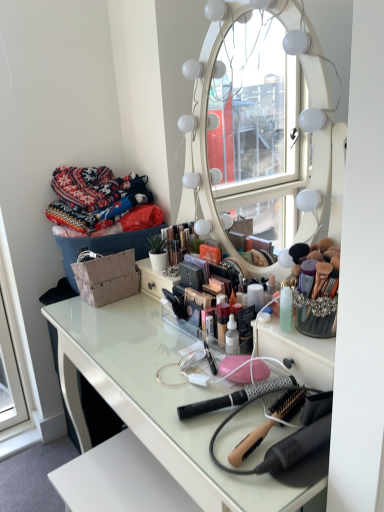
In order to face knitted fabric sweater at upper left, should I rotate leftwards or rightwards?

A 13.528 degree turn to the left will do.

Where is `wooden-handled hairbrush at center, which is counted as the second brush, starting from the back`? wooden-handled hairbrush at center, which is counted as the second brush, starting from the back is located at coordinates (269, 423).

Identify the location of knitted fabric sweater at upper left. The image size is (384, 512). (94, 197).

Is white glossy table at center positioned with its back to knitted fabric sweater at upper left?

white glossy table at center is not turned away from knitted fabric sweater at upper left.

In the scene shown: Considering the positions of objects white glossy table at center and knitted fabric sweater at upper left in the image provided, who is behind, white glossy table at center or knitted fabric sweater at upper left?

knitted fabric sweater at upper left is more distant.

Between white glossy table at center and knitted fabric sweater at upper left, which one appears on the right side from the viewer's perspective?

From the viewer's perspective, white glossy table at center appears more on the right side.

Is white glossy table at center not near knitted fabric sweater at upper left?

No.

From a real-world perspective, who is located lower, knitted fabric sweater at upper left or wooden-handled hairbrush at center, which is counted as the second brush, starting from the back?

wooden-handled hairbrush at center, which is counted as the second brush, starting from the back, from a real-world perspective.

Is knitted fabric sweater at upper left far from wooden-handled hairbrush at center, which is counted as the second brush, starting from the back?

knitted fabric sweater at upper left is actually quite close to wooden-handled hairbrush at center, which is counted as the second brush, starting from the back.

Is knitted fabric sweater at upper left taller than wooden-handled hairbrush at center, which is counted as the second brush, starting from the back?

Yes, knitted fabric sweater at upper left is taller than wooden-handled hairbrush at center, which is counted as the second brush, starting from the back.

Is knitted fabric sweater at upper left turned away from wooden-handled hairbrush at center, which is counted as the second brush, starting from the back?

No.

Does point (70, 371) lie behind point (246, 448)?

Yes, it is.

Looking at this image, from a real-world perspective, between white glossy table at center and wooden-handled hairbrush at center, which is counted as the second brush, starting from the back, who is vertically higher?

wooden-handled hairbrush at center, which is counted as the second brush, starting from the back.

Looking at the image, does white glossy table at center seem bigger or smaller compared to wooden-handled hairbrush at center, which is the 1th brush in front-to-back order?

Considering their sizes, white glossy table at center takes up more space than wooden-handled hairbrush at center, which is the 1th brush in front-to-back order.

Considering the positions of objects white glossy table at center and wooden-handled hairbrush at center, which is counted as the second brush, starting from the back, in the image provided, who is in front, white glossy table at center or wooden-handled hairbrush at center, which is counted as the second brush, starting from the back,?

white glossy table at center is more forward.

Considering the relative sizes of knitted fabric sweater at upper left and black plastic brush at center, placed as the 2th brush when sorted from front to back, in the image provided, is knitted fabric sweater at upper left taller than black plastic brush at center, placed as the 2th brush when sorted from front to back,?

Indeed, knitted fabric sweater at upper left has a greater height compared to black plastic brush at center, placed as the 2th brush when sorted from front to back.

Is knitted fabric sweater at upper left placed right next to black plastic brush at center, placed as the 2th brush when sorted from front to back?

No, knitted fabric sweater at upper left is not with black plastic brush at center, placed as the 2th brush when sorted from front to back.

Between knitted fabric sweater at upper left and black plastic brush at center, the 1th brush when ordered from back to front, which one appears on the left side from the viewer's perspective?

knitted fabric sweater at upper left.

From the picture: Is knitted fabric sweater at upper left positioned with its back to black plastic brush at center, placed as the 2th brush when sorted from front to back?

knitted fabric sweater at upper left does not have its back to black plastic brush at center, placed as the 2th brush when sorted from front to back.

From the image's perspective, is white glossy table at center on black plastic brush at center, the 1th brush when ordered from back to front?

No.

Based on the photo, is white glossy table at center facing towards black plastic brush at center, the 1th brush when ordered from back to front?

No, white glossy table at center is not facing towards black plastic brush at center, the 1th brush when ordered from back to front.

Considering the positions of points (46, 311) and (189, 412), is point (46, 311) farther from camera compared to point (189, 412)?

Yes, point (46, 311) is farther from viewer.

I want to click on the 2nd brush above when counting from the white glossy table at center (from the image's perspective), so click(234, 397).

Does wooden-handled hairbrush at center, which is counted as the second brush, starting from the back, have a smaller size compared to white glossy table at center?

Correct, wooden-handled hairbrush at center, which is counted as the second brush, starting from the back, occupies less space than white glossy table at center.

Is wooden-handled hairbrush at center, which is counted as the second brush, starting from the back, looking in the opposite direction of white glossy table at center?

No.

From the image's perspective, is wooden-handled hairbrush at center, which is counted as the second brush, starting from the back, positioned above or below white glossy table at center?

Based on their image positions, wooden-handled hairbrush at center, which is counted as the second brush, starting from the back, is located above white glossy table at center.

What's the angular difference between wooden-handled hairbrush at center, which is the 1th brush in front-to-back order, and white glossy table at center's facing directions?

The facing directions of wooden-handled hairbrush at center, which is the 1th brush in front-to-back order, and white glossy table at center are 8.26 degrees apart.

Is black plastic brush at center, the 1th brush when ordered from back to front, facing away from knitted fabric sweater at upper left?

No, black plastic brush at center, the 1th brush when ordered from back to front, is not facing the opposite direction of knitted fabric sweater at upper left.

Looking at this image, does black plastic brush at center, placed as the 2th brush when sorted from front to back, have a lesser height compared to knitted fabric sweater at upper left?

Indeed, black plastic brush at center, placed as the 2th brush when sorted from front to back, has a lesser height compared to knitted fabric sweater at upper left.

From a real-world perspective, is black plastic brush at center, the 1th brush when ordered from back to front, under knitted fabric sweater at upper left?

Indeed, from a real-world perspective, black plastic brush at center, the 1th brush when ordered from back to front, is positioned beneath knitted fabric sweater at upper left.

Is black plastic brush at center, the 1th brush when ordered from back to front, placed right next to knitted fabric sweater at upper left?

There is a gap between black plastic brush at center, the 1th brush when ordered from back to front, and knitted fabric sweater at upper left.

The image size is (384, 512). I want to click on material located behind the white glossy table at center, so click(94, 197).

What are the coordinates of `the 2nd brush to the right of the knitted fabric sweater at upper left, counting from the anchor's position` in the screenshot? It's located at (269, 423).

Looking at the image, which one is located closer to black plastic brush at center, the 1th brush when ordered from back to front, knitted fabric sweater at upper left or wooden-handled hairbrush at center, which is the 1th brush in front-to-back order?

wooden-handled hairbrush at center, which is the 1th brush in front-to-back order, lies closer to black plastic brush at center, the 1th brush when ordered from back to front, than the other object.

Estimate the real-world distances between objects in this image. Which object is further from knitted fabric sweater at upper left, white glossy table at center or wooden-handled hairbrush at center, which is counted as the second brush, starting from the back?

The object further to knitted fabric sweater at upper left is wooden-handled hairbrush at center, which is counted as the second brush, starting from the back.

When comparing their distances from wooden-handled hairbrush at center, which is the 1th brush in front-to-back order, does white glossy table at center or knitted fabric sweater at upper left seem closer?

Among the two, white glossy table at center is located nearer to wooden-handled hairbrush at center, which is the 1th brush in front-to-back order.

Looking at the image, which one is located closer to knitted fabric sweater at upper left, wooden-handled hairbrush at center, which is counted as the second brush, starting from the back, or white glossy table at center?

white glossy table at center is closer to knitted fabric sweater at upper left.

When comparing their distances from knitted fabric sweater at upper left, does black plastic brush at center, placed as the 2th brush when sorted from front to back, or wooden-handled hairbrush at center, which is the 1th brush in front-to-back order, seem further?

wooden-handled hairbrush at center, which is the 1th brush in front-to-back order, is further to knitted fabric sweater at upper left.

When comparing their distances from knitted fabric sweater at upper left, does black plastic brush at center, placed as the 2th brush when sorted from front to back, or white glossy table at center seem closer?

white glossy table at center is positioned closer to the anchor knitted fabric sweater at upper left.

When comparing their distances from white glossy table at center, does black plastic brush at center, placed as the 2th brush when sorted from front to back, or wooden-handled hairbrush at center, which is counted as the second brush, starting from the back, seem closer?

The object closer to white glossy table at center is black plastic brush at center, placed as the 2th brush when sorted from front to back.

Which object lies nearer to the anchor point white glossy table at center, knitted fabric sweater at upper left or black plastic brush at center, the 1th brush when ordered from back to front?

black plastic brush at center, the 1th brush when ordered from back to front, lies closer to white glossy table at center than the other object.

In order to click on brush between wooden-handled hairbrush at center, which is counted as the second brush, starting from the back, and knitted fabric sweater at upper left from front to back in this screenshot , I will do `click(234, 397)`.

Locate an element on the screen. brush between black plastic brush at center, the 1th brush when ordered from back to front, and white glossy table at center from top to bottom is located at coordinates (269, 423).